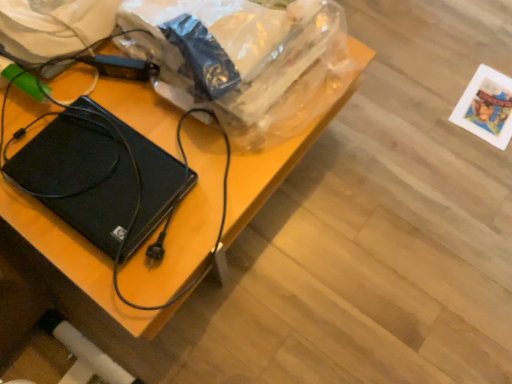
Question: From a real-world perspective, is black matte laptop at left above or below plastic bag at upper center?

Choices:
 (A) above
 (B) below

Answer: (B)

Question: Is black matte laptop at left spatially inside plastic bag at upper center, or outside of it?

Choices:
 (A) outside
 (B) inside

Answer: (A)

Question: Estimate the real-world distances between objects in this image. Which object is farther from the black plastic hard drive at center?

Choices:
 (A) black matte laptop at left
 (B) plastic bag at upper center

Answer: (B)

Question: Which object is the closest to the plastic bag at upper center?

Choices:
 (A) black plastic hard drive at center
 (B) black matte laptop at left

Answer: (A)